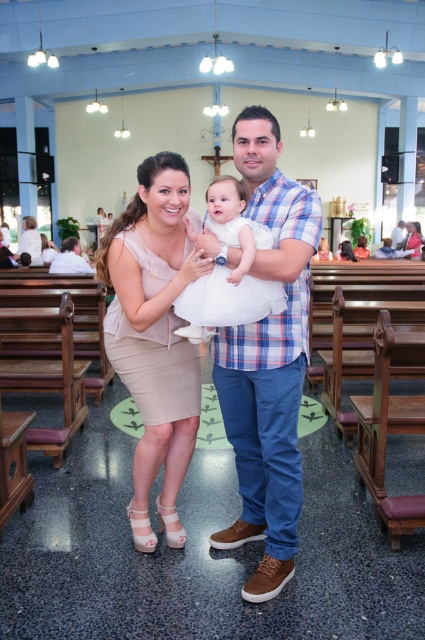
Is beige satin dress at center further to the viewer compared to white tulle dress at center?

Yes, beige satin dress at center is behind white tulle dress at center.

Is beige satin dress at center shorter than white tulle dress at center?

No, beige satin dress at center is not shorter than white tulle dress at center.

Image resolution: width=425 pixels, height=640 pixels. Find the location of `beige satin dress at center`. beige satin dress at center is located at coordinates (155, 336).

Who is higher up, blue plaid shirt at center or beige satin dress at center?

blue plaid shirt at center is above.

Find the location of a particular element. The image size is (425, 640). blue plaid shirt at center is located at coordinates (268, 358).

You are a GUI agent. You are given a task and a screenshot of the screen. Output one action in this format:
    pyautogui.click(x=<x>, y=<y>)
    Task: Click on the blue plaid shirt at center
    
    Given the screenshot: What is the action you would take?
    [268, 358]

Consider the image. Between blue plaid shirt at center and white tulle dress at center, which one appears on the right side from the viewer's perspective?

blue plaid shirt at center is more to the right.

Is blue plaid shirt at center wider than white tulle dress at center?

Indeed, blue plaid shirt at center has a greater width compared to white tulle dress at center.

Describe the element at coordinates (268, 358) in the screenshot. I see `blue plaid shirt at center` at that location.

Where is `blue plaid shirt at center`? The image size is (425, 640). blue plaid shirt at center is located at coordinates (268, 358).